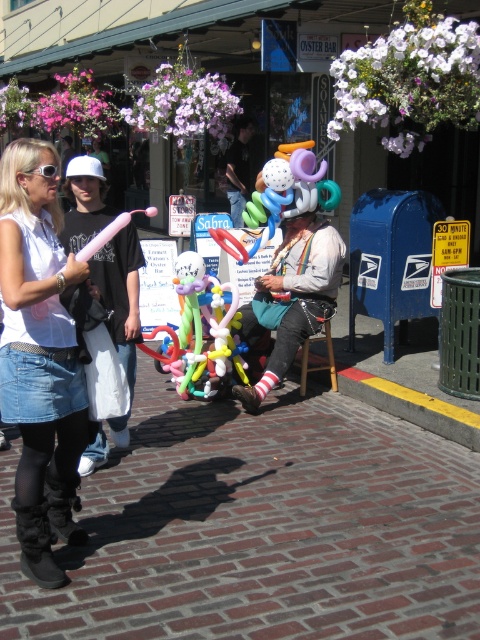
Is denim skirt at lower left wider than multicolored balloon sculpture at center?

In fact, denim skirt at lower left might be narrower than multicolored balloon sculpture at center.

Between denim skirt at lower left and multicolored balloon sculpture at center, which one is positioned higher?

multicolored balloon sculpture at center

Image resolution: width=480 pixels, height=640 pixels. What do you see at coordinates (39, 358) in the screenshot?
I see `denim skirt at lower left` at bounding box center [39, 358].

Where is `denim skirt at lower left`? denim skirt at lower left is located at coordinates (39, 358).

Describe the element at coordinates (39, 358) in the screenshot. I see `denim skirt at lower left` at that location.

Which is behind, point (35, 428) or point (46, 173)?

Point (35, 428)

What do you see at coordinates (39, 358) in the screenshot? I see `denim skirt at lower left` at bounding box center [39, 358].

Image resolution: width=480 pixels, height=640 pixels. Find the location of `denim skirt at lower left`. denim skirt at lower left is located at coordinates (39, 358).

Can you confirm if multicolored balloon sculpture at center is shorter than shiny black jacket at center?

No.

Does multicolored balloon sculpture at center appear over shiny black jacket at center?

A: No, multicolored balloon sculpture at center is not above shiny black jacket at center.

Is point (257, 392) positioned behind point (228, 156)?

No, (257, 392) is closer to viewer.

The image size is (480, 640). In order to click on multicolored balloon sculpture at center in this screenshot , I will do `click(292, 298)`.